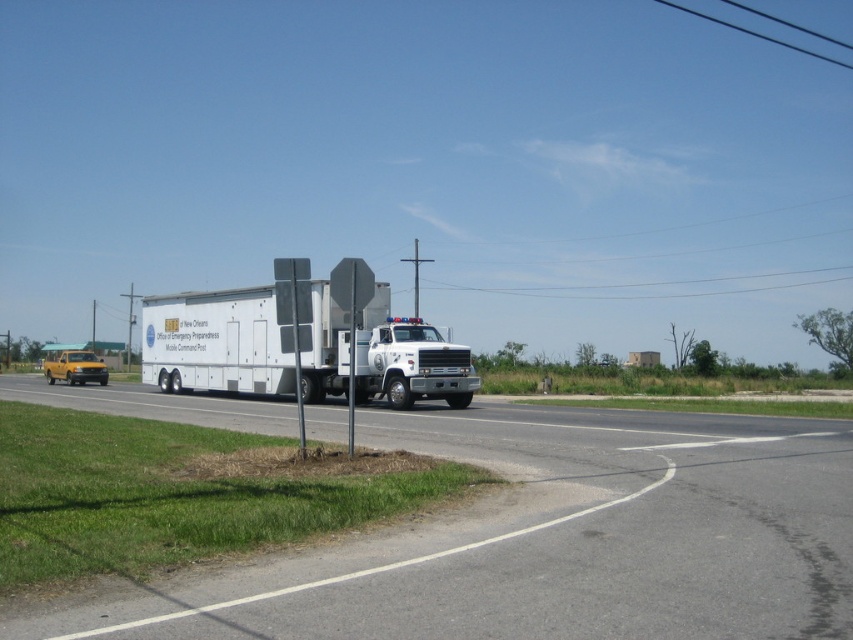
Based on the photo, who is more distant from viewer, (589,477) or (462,406)?

Positioned behind is point (462,406).

Between asphalt road at center and white matte trailer truck at center, which one has more height?

Standing taller between the two is white matte trailer truck at center.

Between point (660, 470) and point (373, 353), which one is positioned behind?

Positioned behind is point (373, 353).

The image size is (853, 640). Find the location of `asphalt road at center`. asphalt road at center is located at coordinates (548, 540).